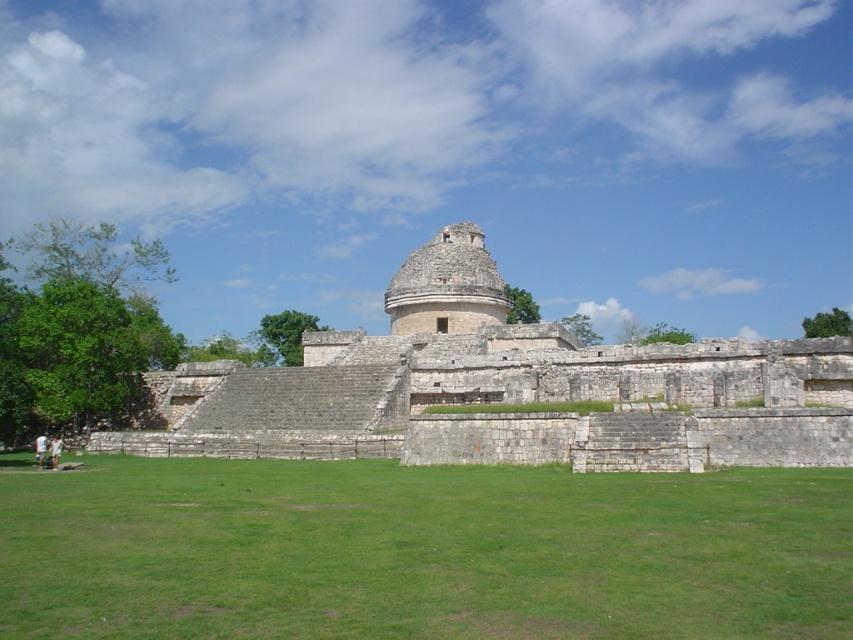
You are standing at the base of the ancient stone structure and want to reach the point marked by the coordinates point (709, 618) and point (473, 240). Which of these points is closer to you?

Point (709, 618) is in front of point (473, 240), so it is closer to you.

You are standing at the point marked as point (421,550) in the image. What is the terrain like where you are standing?

The point (421,550) is on green grass at center, so the terrain is grassy.